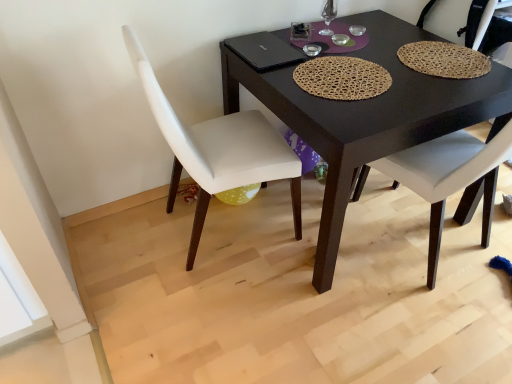
Image resolution: width=512 pixels, height=384 pixels. I want to click on vacant space underneath white leather chair at lower left, the 2th chair when ordered from right to left (from a real-world perspective), so click(219, 230).